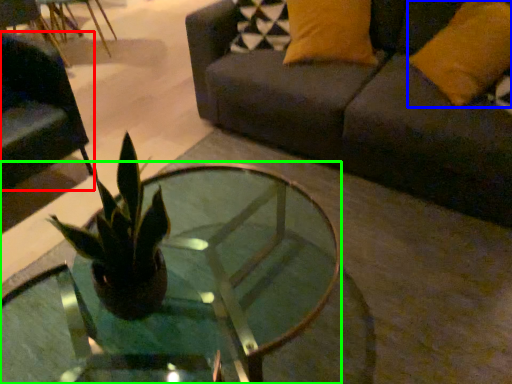
Question: Estimate the real-world distances between objects in this image. Which object is closer to swivel chair (highlighted by a red box), pillow (highlighted by a blue box) or coffee table (highlighted by a green box)?

Choices:
 (A) pillow
 (B) coffee table

Answer: (B)